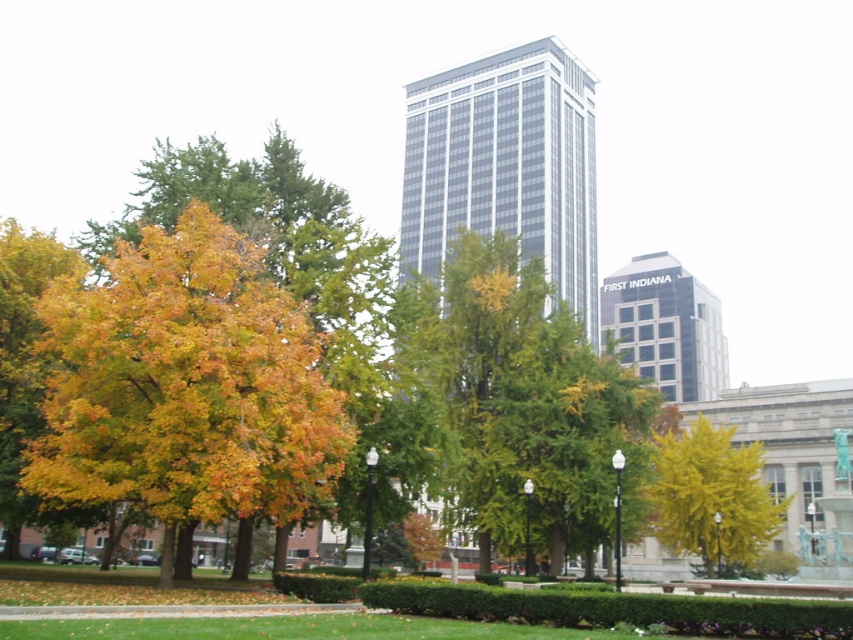
Question: Considering the relative positions of golden yellow leaves at left and green leafy tree at center in the image provided, where is golden yellow leaves at left located with respect to green leafy tree at center?

Choices:
 (A) above
 (B) below

Answer: (B)

Question: Which point appears closest to the camera in this image?

Choices:
 (A) (77, 349)
 (B) (505, 497)

Answer: (A)

Question: Which point is farther to the camera?

Choices:
 (A) (157, 474)
 (B) (732, 516)

Answer: (B)

Question: Is golden yellow leaves at left smaller than yellow/golden leaves at center?

Choices:
 (A) no
 (B) yes

Answer: (B)

Question: Which object is closer to the camera taking this photo?

Choices:
 (A) yellow/golden leaves at center
 (B) golden yellow leaves at left

Answer: (B)

Question: Does golden yellow leaves at left appear over yellow/golden leaves at center?

Choices:
 (A) yes
 (B) no

Answer: (A)